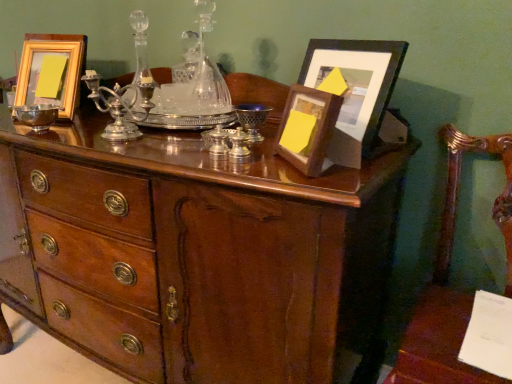
Image resolution: width=512 pixels, height=384 pixels. What are the coordinates of `free space between silver metallic candle holder at center, marked as the 2th candle holder in a right-to-left arrangement, and shiny silver bowl at left` in the screenshot? It's located at (110, 142).